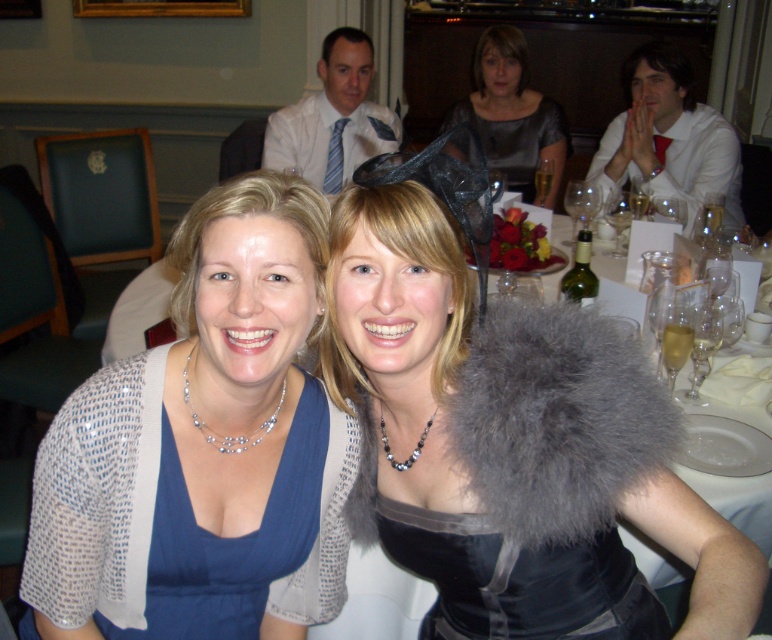
You are a photographer adjusting camera settings for a group photo. You notice the matte silver cardigan at center and the matte white shirt at upper center in your frame. Which item appears shorter in the photo?

The matte silver cardigan at center appears shorter than the matte white shirt at upper center because it is not as tall as the latter.

You are a photographer at the event and want to capture a closeup shot of the shiny silver dress at upper center without the clear glass wine glass at center appearing in the frame. Can you do this if the dress is wider than the glass?

The shiny silver dress at upper center is wider than the clear glass wine glass at center, so yes, it is possible to capture a closeup of the shiny silver dress at upper center without the clear glass wine glass at center appearing in the frame by focusing on the dress and adjusting the camera angle to exclude the glass.

You are standing at a distance of 30 inches from the image. Can you reach the point at coordinates point (496, 321) without moving closer?

The point (496, 321) is 35.63 inches away from the viewer. Since you are only 30 inches away, you cannot reach it without moving closer.